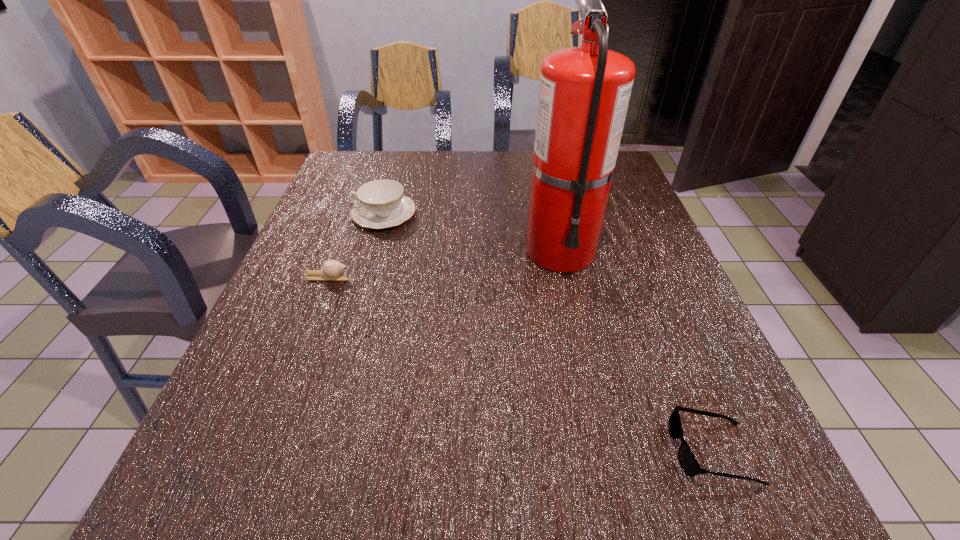
I want to click on vacant space at the right edge of the desktop, so click(x=637, y=278).

This screenshot has height=540, width=960. What are the coordinates of `vacant area at the far right corner of the desktop` in the screenshot? It's located at (618, 160).

Locate an element on the screen. The image size is (960, 540). free space between the sunglasses and the third shortest object is located at coordinates (548, 332).

What are the coordinates of `free space between the second object from right to left and the escargot` in the screenshot? It's located at (444, 264).

The height and width of the screenshot is (540, 960). Identify the location of free space between the second object from right to left and the rightmost object. (636, 350).

Locate an element on the screen. The width and height of the screenshot is (960, 540). vacant space in between the escargot and the nearest object is located at coordinates (519, 364).

The width and height of the screenshot is (960, 540). Identify the location of vacant space that's between the escargot and the chinaware. (355, 245).

Locate an element on the screen. This screenshot has height=540, width=960. free space that is in between the chinaware and the sunglasses is located at coordinates (548, 332).

Where is `vacant area between the escargot and the fire extinguisher`? vacant area between the escargot and the fire extinguisher is located at coordinates (444, 264).

At what (x,y) coordinates should I click in order to perform the action: click on free space between the second object from right to left and the chinaware. Please return your answer as a coordinate pair (x, y). Looking at the image, I should click on (472, 232).